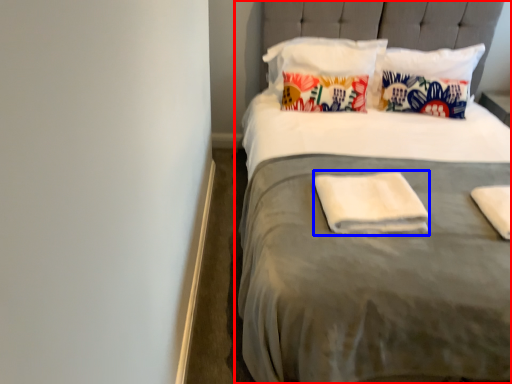
Question: Which object is further to the camera taking this photo, bed (highlighted by a red box) or material (highlighted by a blue box)?

Choices:
 (A) bed
 (B) material

Answer: (B)